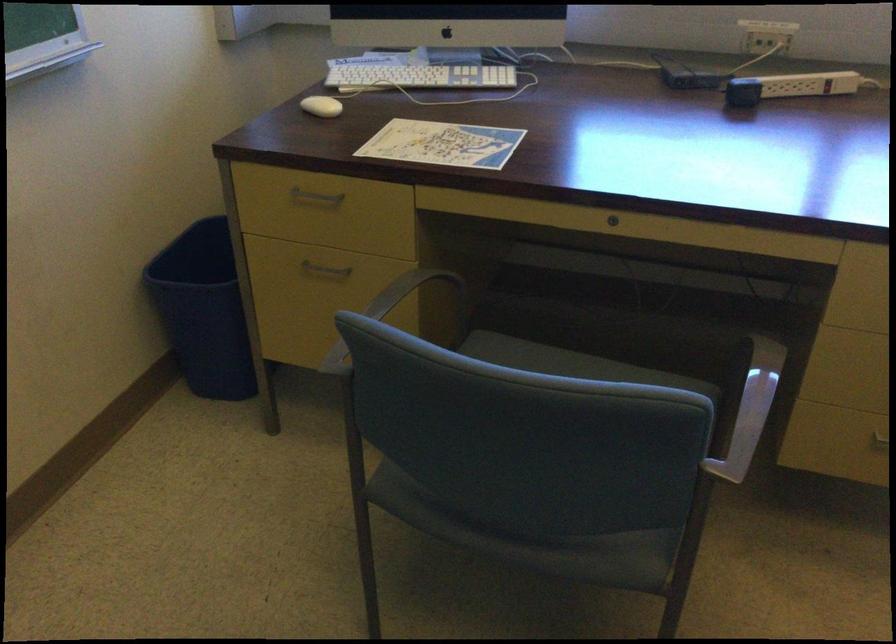
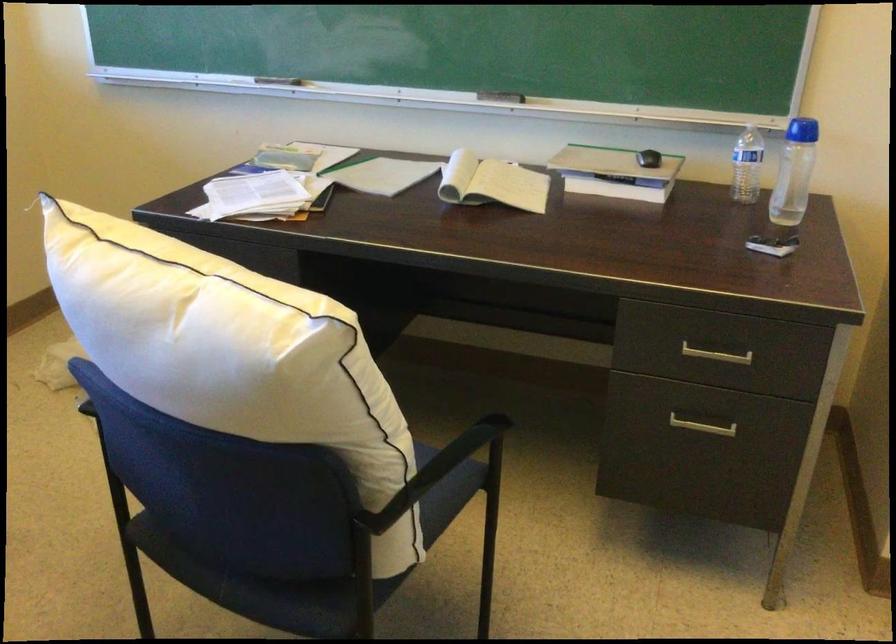
How did the camera likely rotate?

The camera rotated toward right-down.